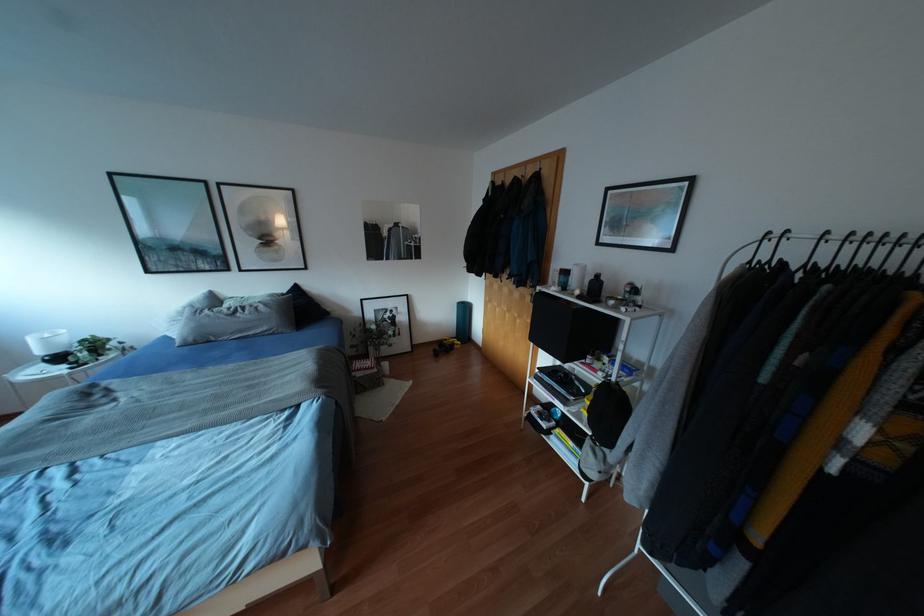
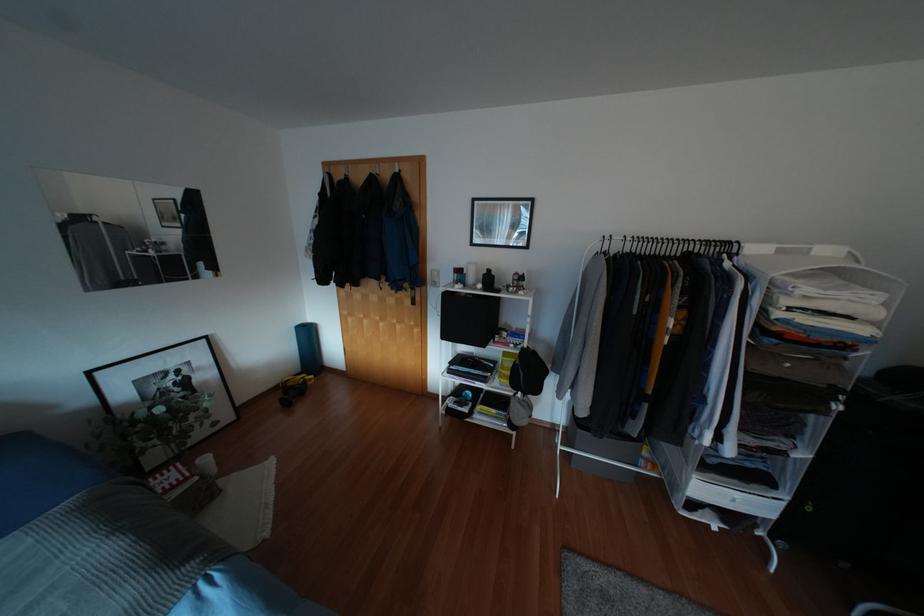
Locate, in the second image, the point that corresponds to point (578, 296) in the first image.

(483, 289)